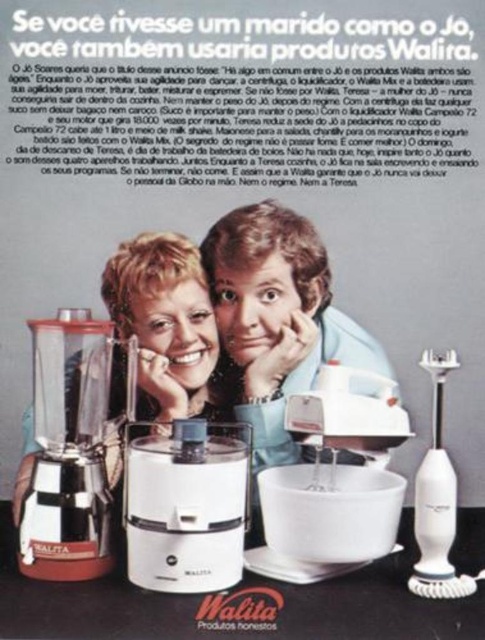
You are a delivery person who needs to place a 36 inch long package on the counter in front of the white plastic mixer at center. Can the package fit in front of the mixer without overlapping it?

The distance of white plastic mixer at center from camera is 34.28 inches. Since the package is 36 inches long, it would extend beyond the space in front of the mixer, overlapping it. The package cannot fit without overlapping.

Looking at this image, you are standing in front of the Walita product advertisement. There are two points marked in the image. The first point is at coordinates point (267,477) and the second point is at point (475,582). Which point is closer to the viewer?

Point (475,582) is closer to the viewer because it is in front of point (267,477).